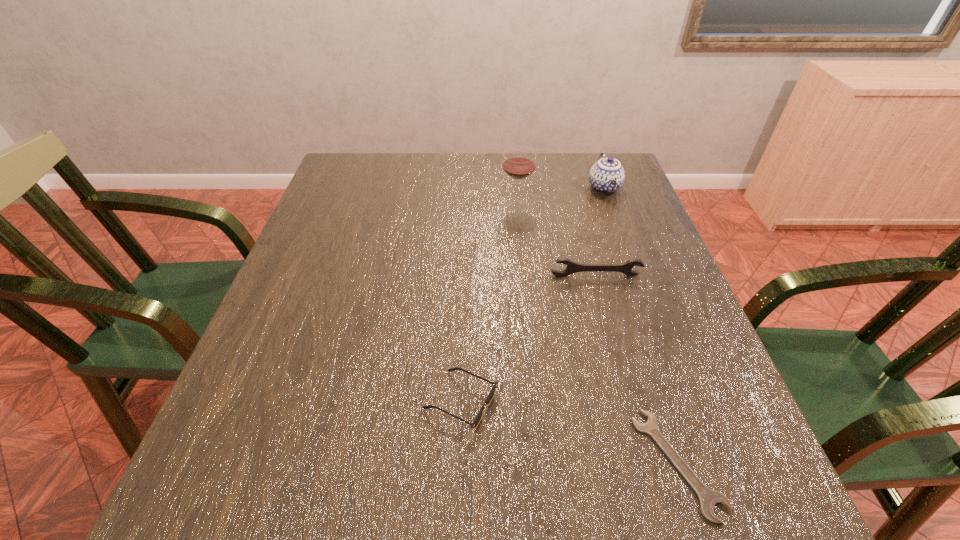
Where is `free space at the near edge of the desktop`? This screenshot has height=540, width=960. free space at the near edge of the desktop is located at coordinates (401, 528).

This screenshot has height=540, width=960. Find the location of `vacant space at the left edge of the desktop`. vacant space at the left edge of the desktop is located at coordinates (264, 332).

Locate an element on the screen. The height and width of the screenshot is (540, 960). free region at the right edge of the desktop is located at coordinates (685, 364).

Find the location of a particular element. This screenshot has height=540, width=960. vacant space that is in between the fourth object from right to left and the taller wrench is located at coordinates [x=556, y=240].

What are the coordinates of `unoccupied area between the leftmost object and the chinaware` in the screenshot? It's located at (533, 294).

Locate an element on the screen. Image resolution: width=960 pixels, height=540 pixels. free spot between the wineglass and the chinaware is located at coordinates coord(561,196).

At what (x,y) coordinates should I click in order to perform the action: click on free space between the farther wrench and the second object from left to right. Please return your answer as a coordinate pair (x, y). Looking at the image, I should click on (556, 240).

The width and height of the screenshot is (960, 540). I want to click on vacant space that's between the leftmost object and the farther wrench, so click(x=528, y=339).

Where is `free space between the shorter wrench and the chinaware`? free space between the shorter wrench and the chinaware is located at coordinates (641, 326).

Where is `vacant area that lies between the sunglasses and the farther wrench`? The height and width of the screenshot is (540, 960). vacant area that lies between the sunglasses and the farther wrench is located at coordinates (528, 339).